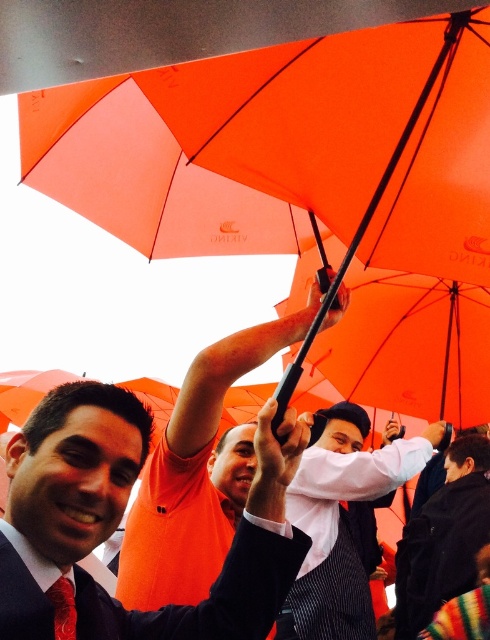
Between orange matte umbrella at upper center and white shirt at center, which one is positioned higher?

Positioned higher is orange matte umbrella at upper center.

Between orange matte umbrella at upper center and white shirt at center, which one has less height?

orange matte umbrella at upper center

Is point (476, 225) farther from camera compared to point (359, 611)?

That is False.

This screenshot has height=640, width=490. I want to click on orange matte umbrella at upper center, so click(x=231, y=140).

Locate an element on the screen. The height and width of the screenshot is (640, 490). white shirt at center is located at coordinates (343, 520).

Who is more forward, (316, 595) or (58, 621)?

Point (58, 621) is in front.

Image resolution: width=490 pixels, height=640 pixels. What do you see at coordinates (343, 520) in the screenshot?
I see `white shirt at center` at bounding box center [343, 520].

Find the location of `white shirt at center`. white shirt at center is located at coordinates (343, 520).

Is point (54, 449) farther from viewer compared to point (58, 589)?

Yes, point (54, 449) is behind point (58, 589).

Where is `matte orange shirt at upper center`? matte orange shirt at upper center is located at coordinates (124, 506).

This screenshot has width=490, height=640. Describe the element at coordinates (124, 506) in the screenshot. I see `matte orange shirt at upper center` at that location.

Where is `matte orange shirt at upper center`? matte orange shirt at upper center is located at coordinates (124, 506).